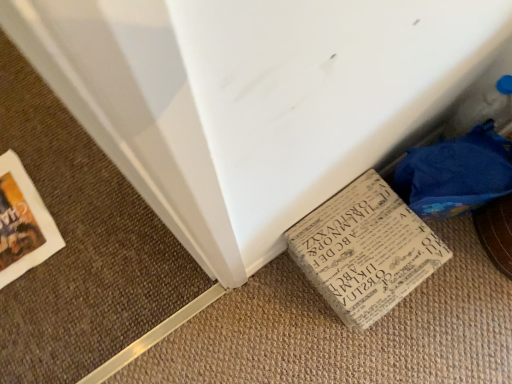
The height and width of the screenshot is (384, 512). Find the location of `free space in front of white paper puzzle at lower right`. free space in front of white paper puzzle at lower right is located at coordinates (454, 298).